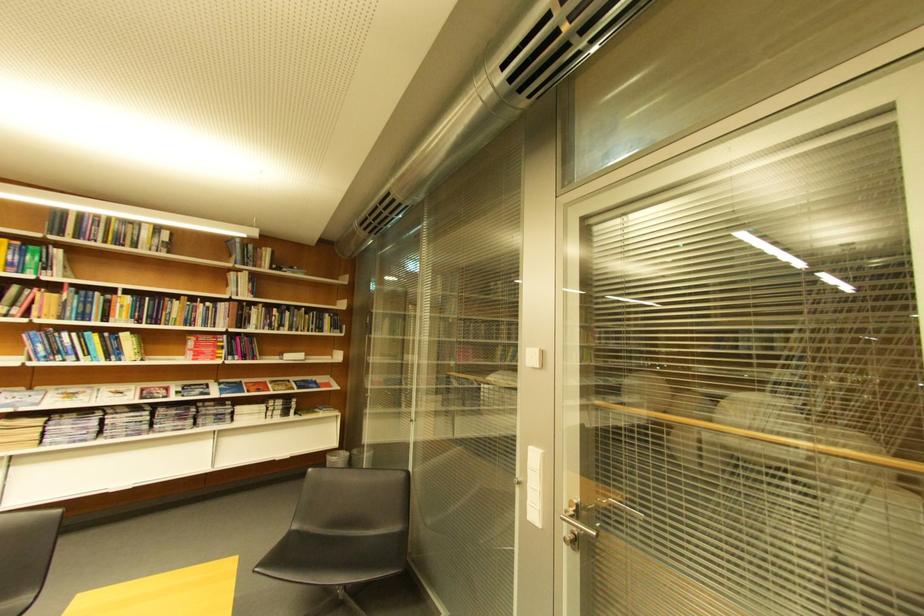
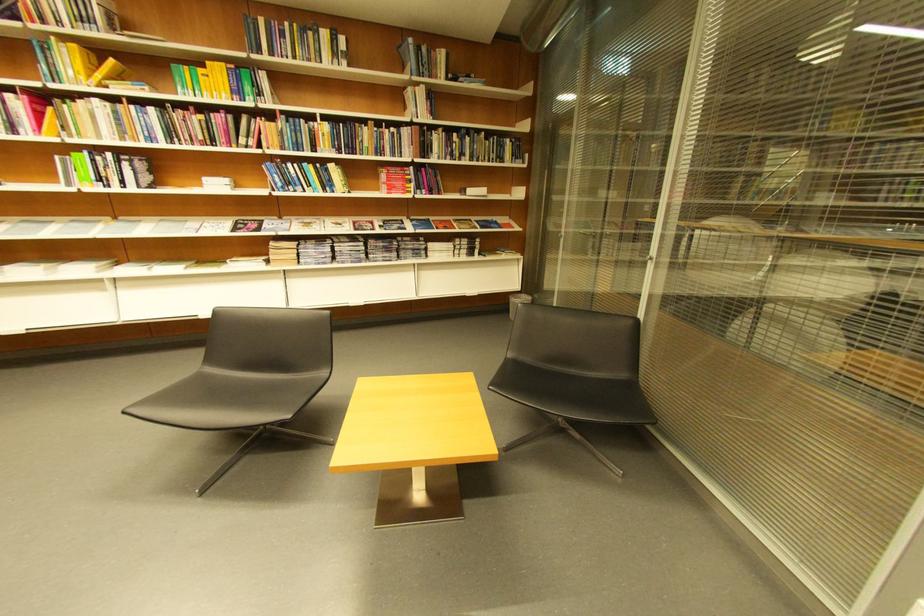
In the second image, find the point that corresponds to the point at 348,453 in the first image.

(529, 297)